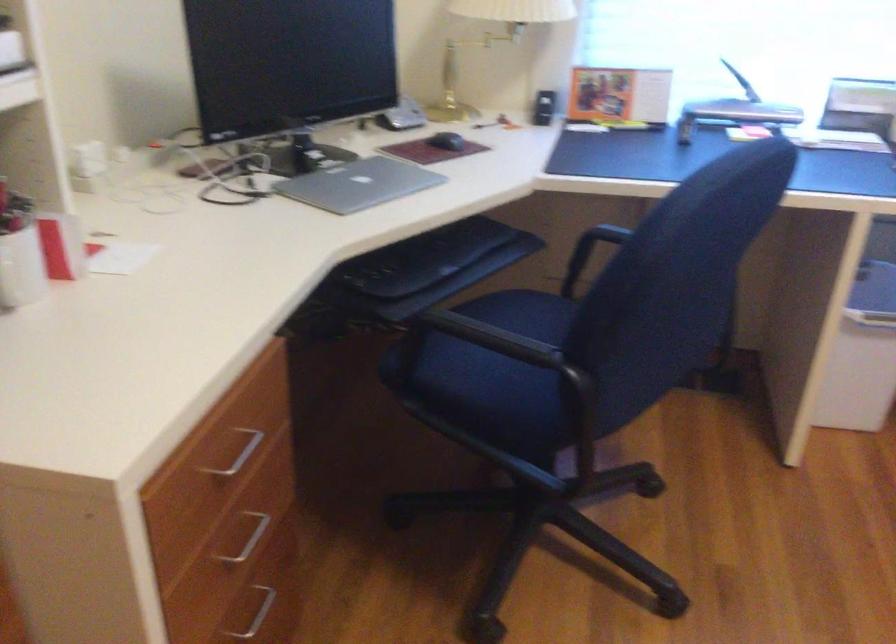
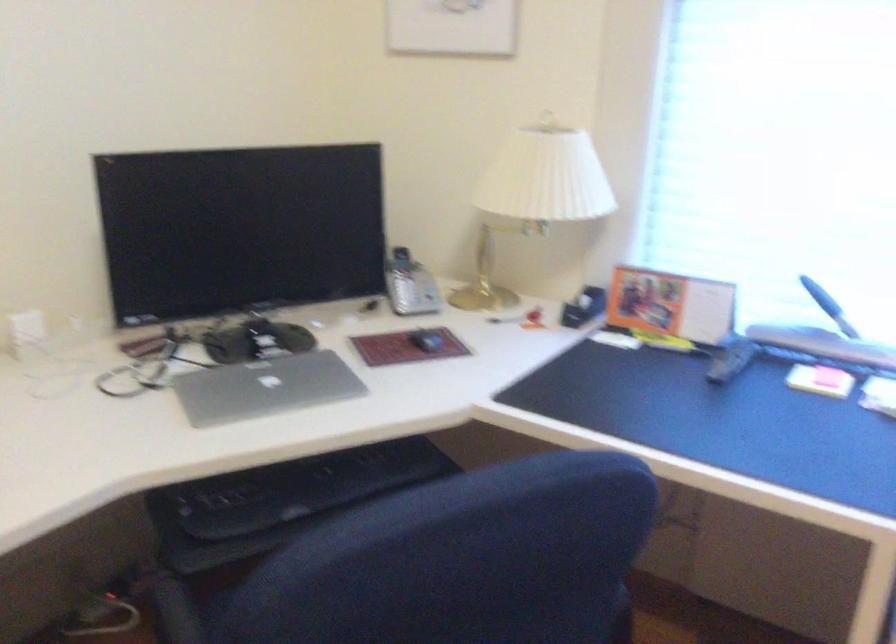
Which direction would the cameraman need to move to produce the second image?

The cameraman moved toward right, forward.